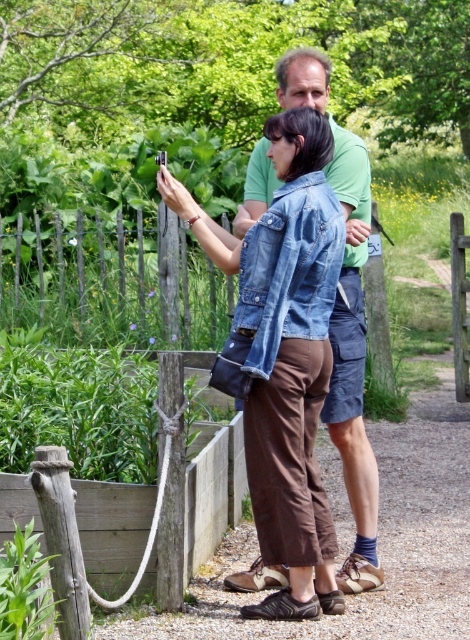
Is denim jacket at lower right taller than denim jacket at center?

Correct, denim jacket at lower right is much taller as denim jacket at center.

Which is more to the right, denim jacket at lower right or denim jacket at center?

denim jacket at center is more to the right.

Does point (313, 241) lie in front of point (280, 579)?

Yes.

This screenshot has height=640, width=470. Find the location of `denim jacket at lower right`. denim jacket at lower right is located at coordinates (289, 269).

Does wooden fence at left appear on the right side of denim jacket at center?

No, wooden fence at left is not to the right of denim jacket at center.

Is wooden fence at left positioned before denim jacket at center?

That is False.

The width and height of the screenshot is (470, 640). What do you see at coordinates (110, 280) in the screenshot?
I see `wooden fence at left` at bounding box center [110, 280].

Find the location of `wooden fence at left`. wooden fence at left is located at coordinates (110, 280).

Can you confirm if wooden fence at left is wider than denim jacket at lower right?

Yes.

Does point (188, 337) come behind point (296, 205)?

Yes, it is.

Identify the location of wooden fence at left. (110, 280).